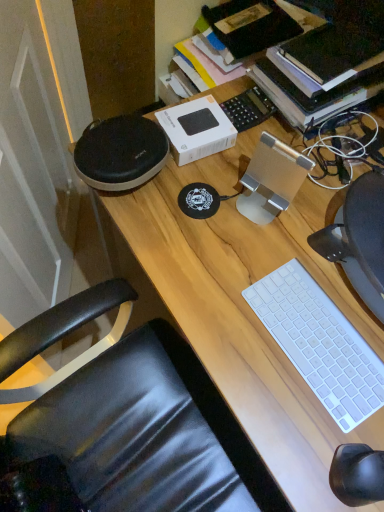
This screenshot has width=384, height=512. Find the location of `free space behind white plastic keyboard at lower right`. free space behind white plastic keyboard at lower right is located at coordinates (301, 255).